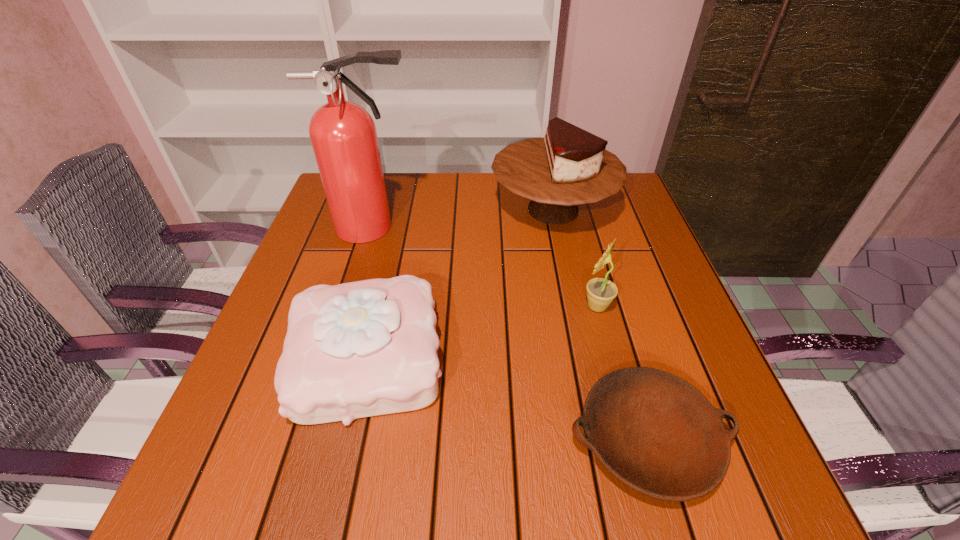
Find the location of a particular element. The image size is (960, 540). vacant space at the near right corner of the desktop is located at coordinates (751, 509).

The height and width of the screenshot is (540, 960). What are the coordinates of `vacant area that lies between the shortest object and the tallest object` in the screenshot? It's located at (511, 334).

Locate an element on the screen. Image resolution: width=960 pixels, height=540 pixels. vacant area that lies between the sunflower and the farther cake is located at coordinates (575, 258).

This screenshot has height=540, width=960. What are the coordinates of `free spot between the plate and the fire extinguisher` in the screenshot? It's located at (511, 334).

Locate an element on the screen. vacant area that lies between the fire extinguisher and the plate is located at coordinates (511, 334).

Where is `vacant point located between the fourth tallest object and the right cake`? The width and height of the screenshot is (960, 540). vacant point located between the fourth tallest object and the right cake is located at coordinates (461, 284).

Locate an element on the screen. The height and width of the screenshot is (540, 960). vacant area between the shortest object and the nearer cake is located at coordinates (508, 399).

I want to click on vacant space that is in between the plate and the shorter cake, so click(508, 399).

The height and width of the screenshot is (540, 960). In order to click on vacant area that lies between the plate and the fourth tallest object in this screenshot , I will do `click(508, 399)`.

At what (x,y) coordinates should I click in order to perform the action: click on unoccupied position between the taller cake and the tallest object. Please return your answer as a coordinate pair (x, y). The width and height of the screenshot is (960, 540). Looking at the image, I should click on (464, 218).